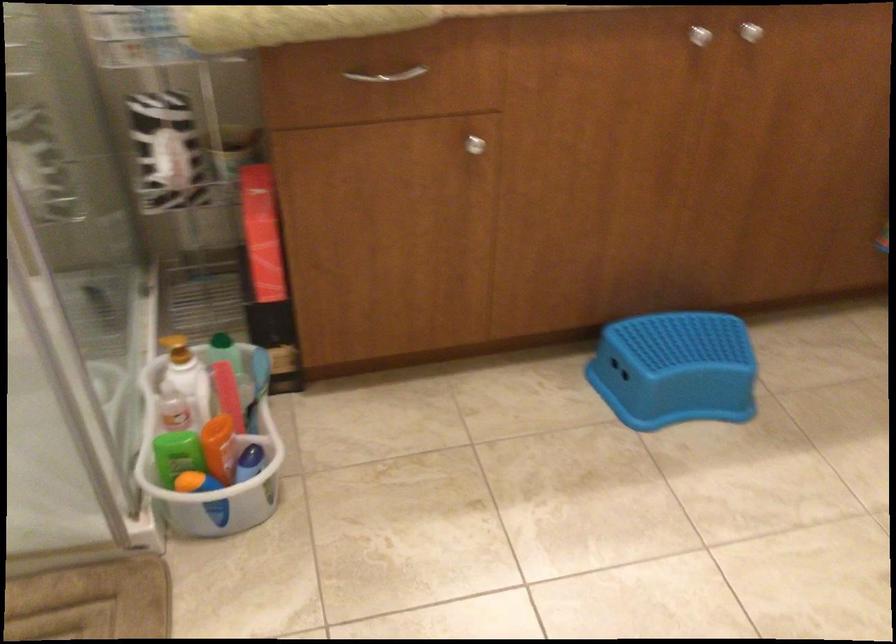
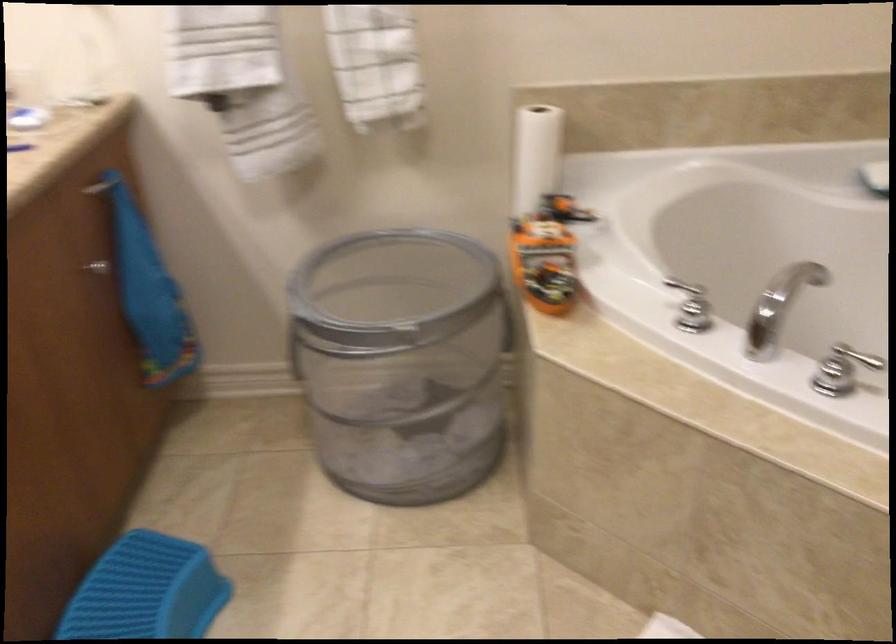
The images are taken continuously from a first-person perspective. In which direction is your viewpoint rotating?

The camera rotated toward right-down.